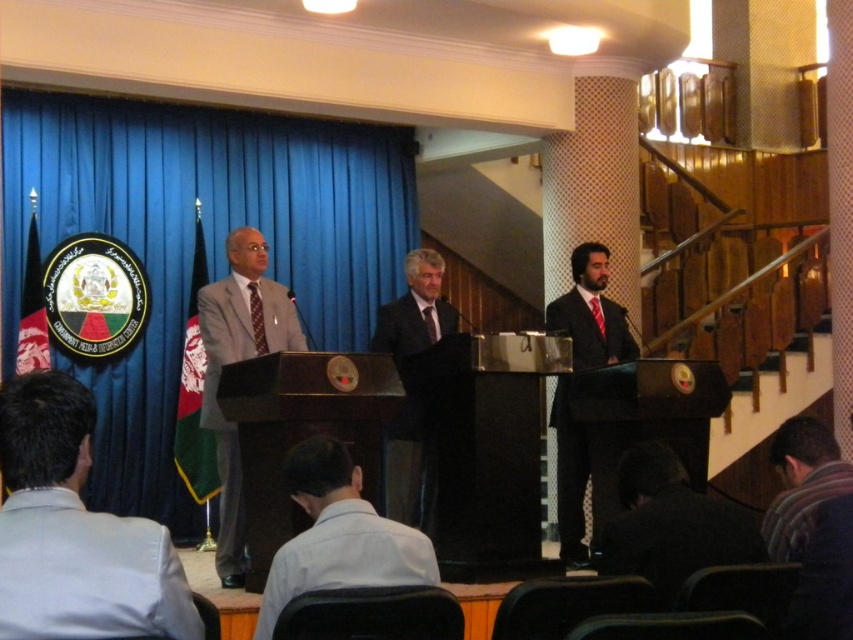
You are organizing a photo shoot and need to know the relative sizes of the blue fabric curtain at left and the striped sweater at lower right. Which object is larger?

The blue fabric curtain at left is bigger than the striped sweater at lower right.

You are organizing a small indoor event and need to decide whether to place a 2m wide decorative panel between the blue fabric curtain at left and the striped sweater at lower right. Based on their sizes, will the panel fit between them?

The blue fabric curtain at left is wider than the striped sweater at lower right. However, the exact distance between them isn generated from the provided information, so it is impossible to determine if the 2m wide decorative panel will fit between them.

You are organizing a photo shoot and need to ensure that the two main subjects wearing the light gray suit at lower left and the matte black suit at right are framed properly. Based on their spatial presence in the image, which subject should you focus on first to ensure they are centered in the frame?

The light gray suit at lower left occupies less space than the matte black suit at right, so you should focus on the matte black suit at right first as it takes up more space and would require more attention to center properly.